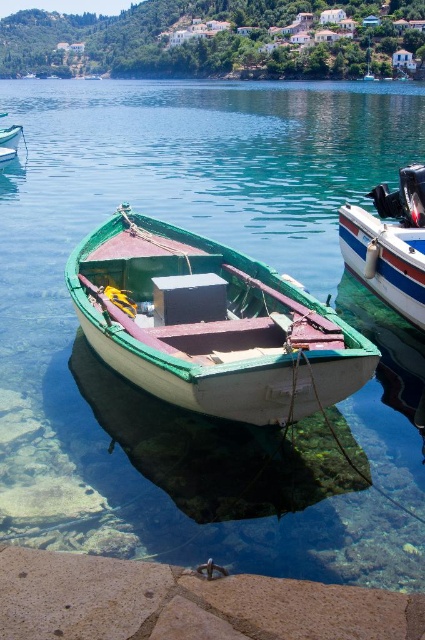
Who is lower down, green wooden boat at center or white glossy boat at right?

Positioned lower is green wooden boat at center.

Who is positioned more to the right, green wooden boat at center or white glossy boat at right?

white glossy boat at right is more to the right.

Which is behind, point (274, 296) or point (387, 288)?

Positioned behind is point (387, 288).

The height and width of the screenshot is (640, 425). Find the location of `green wooden boat at center`. green wooden boat at center is located at coordinates (209, 324).

From the picture: Between green wooden boat at center and brown stone at lower left, which one is positioned higher?

green wooden boat at center

Who is more distant from viewer, (348,348) or (73,600)?

Positioned behind is point (348,348).

Which is in front, point (186, 337) or point (244, 600)?

Point (244, 600) is in front.

Locate an element on the screen. green wooden boat at center is located at coordinates (209, 324).

Who is positioned more to the left, brown stone at lower left or white glossy boat at right?

From the viewer's perspective, brown stone at lower left appears more on the left side.

Does point (198, 611) lie behind point (393, 307)?

No, (198, 611) is in front of (393, 307).

Image resolution: width=425 pixels, height=640 pixels. I want to click on brown stone at lower left, so click(x=186, y=602).